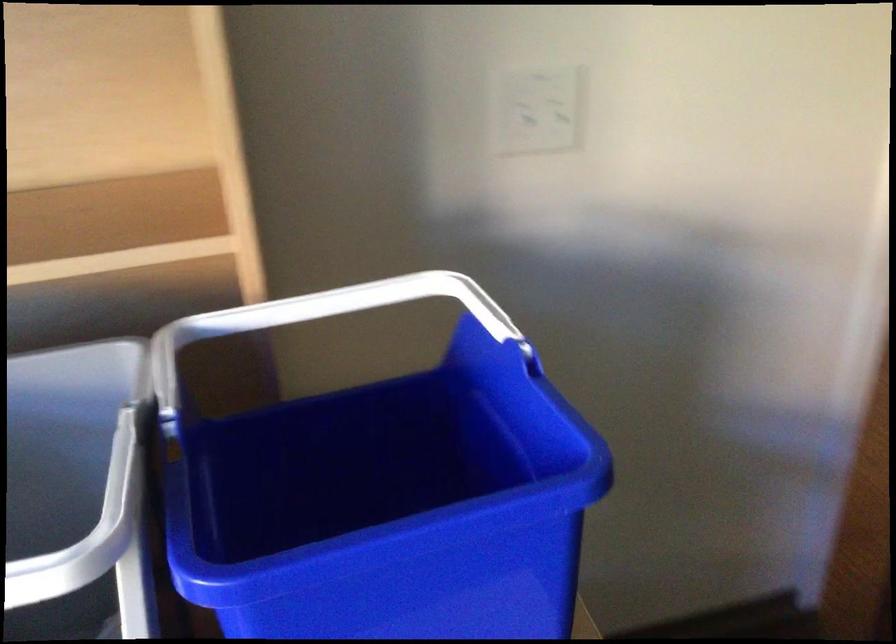
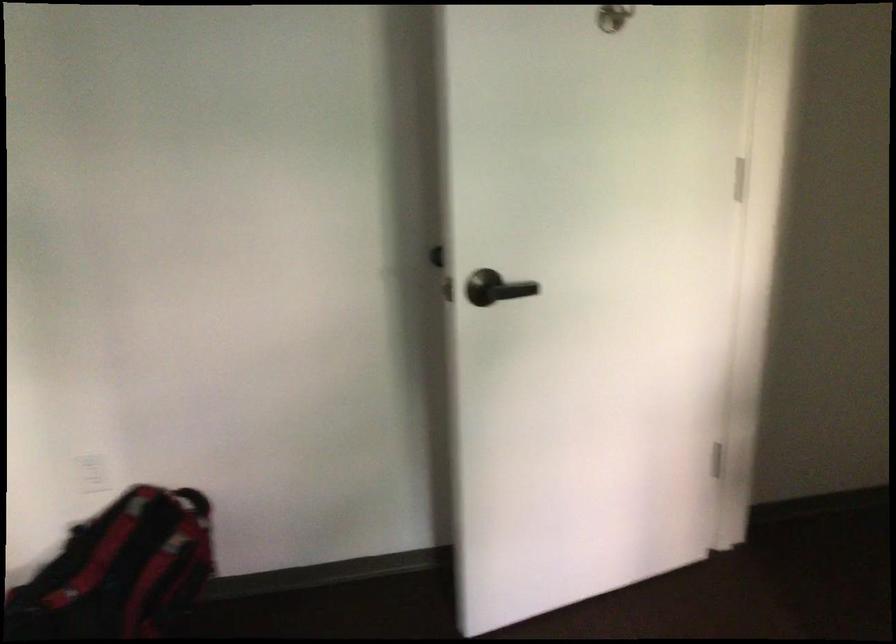
Question: The images are taken continuously from a first-person perspective. In which direction is your viewpoint rotating?

Choices:
 (A) Left
 (B) Right
 (C) Up
 (D) Down

Answer: (B)